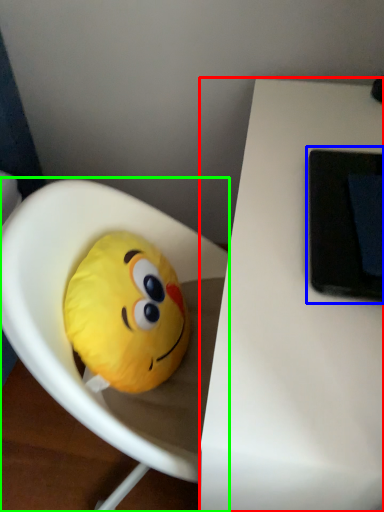
Question: Which object is positioned farthest from table (highlighted by a red box)? Select from tablet computer (highlighted by a blue box) and toy (highlighted by a green box).

Choices:
 (A) tablet computer
 (B) toy

Answer: (B)